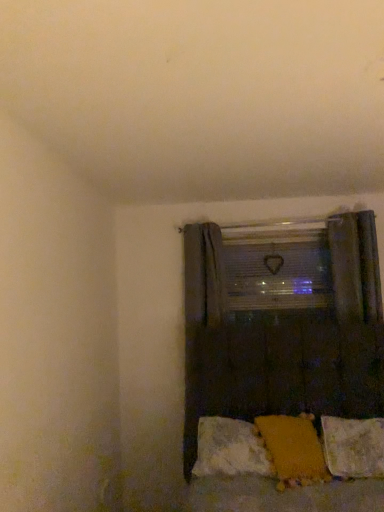
Describe the element at coordinates (230, 449) in the screenshot. The width and height of the screenshot is (384, 512). I see `orange fabric pillow at lower center, which is counted as the first pillow, starting from the left` at that location.

This screenshot has width=384, height=512. I want to click on fluffy white pillow at lower right, which is the first pillow in right-to-left order, so click(x=353, y=447).

Measure the distance between fluffy white pillow at lower right, which is the first pillow in right-to-left order, and camera.

A distance of 2.24 meters exists between fluffy white pillow at lower right, which is the first pillow in right-to-left order, and camera.

Identify the location of orange fabric pillow at lower center, the third pillow from the right. (230, 449).

Is orange fabric pillow at lower center, the third pillow from the right, inside or outside of yellow fabric pillow at lower center, which ranks as the 2th pillow in left-to-right order?

orange fabric pillow at lower center, the third pillow from the right, exists entirely within yellow fabric pillow at lower center, which ranks as the 2th pillow in left-to-right order.

From the image's perspective, is orange fabric pillow at lower center, the third pillow from the right, under yellow fabric pillow at lower center, which ranks as the 2th pillow in left-to-right order?

Correct, orange fabric pillow at lower center, the third pillow from the right, appears lower than yellow fabric pillow at lower center, which ranks as the 2th pillow in left-to-right order, in the image.

From a real-world perspective, is orange fabric pillow at lower center, which is counted as the first pillow, starting from the left, over yellow fabric pillow at lower center, positioned as the second pillow in right-to-left order?

No.

Can you confirm if orange fabric pillow at lower center, the third pillow from the right, is thinner than yellow fabric pillow at lower center, positioned as the second pillow in right-to-left order?

Indeed, orange fabric pillow at lower center, the third pillow from the right, has a lesser width compared to yellow fabric pillow at lower center, positioned as the second pillow in right-to-left order.

Is fluffy white pillow at lower right, the 3th pillow when ordered from left to right, behind orange fabric pillow at lower center, the third pillow from the right?

That is False.

Can we say fluffy white pillow at lower right, the 3th pillow when ordered from left to right, lies outside orange fabric pillow at lower center, which is counted as the first pillow, starting from the left?

fluffy white pillow at lower right, the 3th pillow when ordered from left to right, is positioned outside orange fabric pillow at lower center, which is counted as the first pillow, starting from the left.

From a real-world perspective, which pillow is the 1st one above the fluffy white pillow at lower right, which is the first pillow in right-to-left order? Please provide its 2D coordinates.

[(230, 449)]

From a real-world perspective, which object stands above the other?

orange fabric pillow at lower center, which is counted as the first pillow, starting from the left.

Relative to yellow fabric pillow at lower center, positioned as the second pillow in right-to-left order, is fluffy white pillow at lower right, the 3th pillow when ordered from left to right, in front or behind?

fluffy white pillow at lower right, the 3th pillow when ordered from left to right, is positioned farther from the viewer than yellow fabric pillow at lower center, positioned as the second pillow in right-to-left order.

Which of these two, fluffy white pillow at lower right, the 3th pillow when ordered from left to right, or yellow fabric pillow at lower center, positioned as the second pillow in right-to-left order, is smaller?

Smaller between the two is yellow fabric pillow at lower center, positioned as the second pillow in right-to-left order.

Measure the distance from fluffy white pillow at lower right, the 3th pillow when ordered from left to right, to yellow fabric pillow at lower center, positioned as the second pillow in right-to-left order.

They are 7.87 inches apart.

Is fluffy white pillow at lower right, which is the first pillow in right-to-left order, inside or outside of yellow fabric pillow at lower center, positioned as the second pillow in right-to-left order?

fluffy white pillow at lower right, which is the first pillow in right-to-left order, is spatially situated outside yellow fabric pillow at lower center, positioned as the second pillow in right-to-left order.

Looking at this image, from the image's perspective, is yellow fabric pillow at lower center, positioned as the second pillow in right-to-left order, located above clear plastic window screen at center?

No.

From a real-world perspective, is yellow fabric pillow at lower center, positioned as the second pillow in right-to-left order, under clear plastic window screen at center?

Yes.

Can you confirm if yellow fabric pillow at lower center, positioned as the second pillow in right-to-left order, is positioned to the left of clear plastic window screen at center?

Yes, yellow fabric pillow at lower center, positioned as the second pillow in right-to-left order, is to the left of clear plastic window screen at center.

How different are the orientations of yellow fabric pillow at lower center, which ranks as the 2th pillow in left-to-right order, and clear plastic window screen at center in degrees?

16.5 degrees.

From a real-world perspective, which is physically below, clear plastic window screen at center or orange fabric pillow at lower center, the third pillow from the right?

orange fabric pillow at lower center, the third pillow from the right, from a real-world perspective.

In the scene shown: Which is more to the right, clear plastic window screen at center or orange fabric pillow at lower center, which is counted as the first pillow, starting from the left?

Positioned to the right is clear plastic window screen at center.

Is clear plastic window screen at center oriented towards orange fabric pillow at lower center, the third pillow from the right?

No, clear plastic window screen at center is not aimed at orange fabric pillow at lower center, the third pillow from the right.

From the image's perspective, is yellow fabric pillow at lower center, which ranks as the 2th pillow in left-to-right order, located above fluffy white pillow at lower right, which is the first pillow in right-to-left order?

Yes, from the image's perspective, yellow fabric pillow at lower center, which ranks as the 2th pillow in left-to-right order, is on top of fluffy white pillow at lower right, which is the first pillow in right-to-left order.

The width and height of the screenshot is (384, 512). Find the location of `the 2nd pillow above the fluffy white pillow at lower right, the 3th pillow when ordered from left to right (from the image's perspective)`. the 2nd pillow above the fluffy white pillow at lower right, the 3th pillow when ordered from left to right (from the image's perspective) is located at coordinates (293, 449).

Is yellow fabric pillow at lower center, positioned as the second pillow in right-to-left order, taller or shorter than fluffy white pillow at lower right, the 3th pillow when ordered from left to right?

Considering their sizes, yellow fabric pillow at lower center, positioned as the second pillow in right-to-left order, has more height than fluffy white pillow at lower right, the 3th pillow when ordered from left to right.

From a real-world perspective, is yellow fabric pillow at lower center, which ranks as the 2th pillow in left-to-right order, on fluffy white pillow at lower right, which is the first pillow in right-to-left order?

Indeed, from a real-world perspective, yellow fabric pillow at lower center, which ranks as the 2th pillow in left-to-right order, stands above fluffy white pillow at lower right, which is the first pillow in right-to-left order.

Is the position of clear plastic window screen at center more distant than that of yellow fabric pillow at lower center, which ranks as the 2th pillow in left-to-right order?

Yes, the depth of clear plastic window screen at center is greater than that of yellow fabric pillow at lower center, which ranks as the 2th pillow in left-to-right order.

Is clear plastic window screen at center not close to yellow fabric pillow at lower center, which ranks as the 2th pillow in left-to-right order?

Yes.

Considering the sizes of objects clear plastic window screen at center and yellow fabric pillow at lower center, positioned as the second pillow in right-to-left order, in the image provided, who is shorter, clear plastic window screen at center or yellow fabric pillow at lower center, positioned as the second pillow in right-to-left order,?

yellow fabric pillow at lower center, positioned as the second pillow in right-to-left order, is shorter.

Can you tell me how much clear plastic window screen at center and yellow fabric pillow at lower center, positioned as the second pillow in right-to-left order, differ in facing direction?

The angle between the facing direction of clear plastic window screen at center and the facing direction of yellow fabric pillow at lower center, positioned as the second pillow in right-to-left order, is 16.5 degrees.

Identify the location of pillow to the left of yellow fabric pillow at lower center, positioned as the second pillow in right-to-left order. The height and width of the screenshot is (512, 384). (230, 449).

The width and height of the screenshot is (384, 512). I want to click on pillow beneath the orange fabric pillow at lower center, which is counted as the first pillow, starting from the left (from a real-world perspective), so click(x=353, y=447).

From the image, which object appears to be nearer to fluffy white pillow at lower right, which is the first pillow in right-to-left order, clear plastic window screen at center or orange fabric pillow at lower center, which is counted as the first pillow, starting from the left?

The object closer to fluffy white pillow at lower right, which is the first pillow in right-to-left order, is orange fabric pillow at lower center, which is counted as the first pillow, starting from the left.

Considering their positions, is fluffy white pillow at lower right, which is the first pillow in right-to-left order, positioned closer to yellow fabric pillow at lower center, which ranks as the 2th pillow in left-to-right order, than clear plastic window screen at center?

Based on the image, fluffy white pillow at lower right, which is the first pillow in right-to-left order, appears to be nearer to yellow fabric pillow at lower center, which ranks as the 2th pillow in left-to-right order.

From the image, which object appears to be farther from orange fabric pillow at lower center, which is counted as the first pillow, starting from the left, fluffy white pillow at lower right, the 3th pillow when ordered from left to right, or yellow fabric pillow at lower center, which ranks as the 2th pillow in left-to-right order?

fluffy white pillow at lower right, the 3th pillow when ordered from left to right, lies further to orange fabric pillow at lower center, which is counted as the first pillow, starting from the left, than the other object.

When comparing their distances from yellow fabric pillow at lower center, which ranks as the 2th pillow in left-to-right order, does orange fabric pillow at lower center, the third pillow from the right, or fluffy white pillow at lower right, which is the first pillow in right-to-left order, seem closer?

orange fabric pillow at lower center, the third pillow from the right, lies closer to yellow fabric pillow at lower center, which ranks as the 2th pillow in left-to-right order, than the other object.

Which object lies further to the anchor point clear plastic window screen at center, yellow fabric pillow at lower center, positioned as the second pillow in right-to-left order, or orange fabric pillow at lower center, the third pillow from the right?

Among the two, yellow fabric pillow at lower center, positioned as the second pillow in right-to-left order, is located further to clear plastic window screen at center.

Based on their spatial positions, is yellow fabric pillow at lower center, positioned as the second pillow in right-to-left order, or orange fabric pillow at lower center, the third pillow from the right, further from fluffy white pillow at lower right, the 3th pillow when ordered from left to right?

Among the two, orange fabric pillow at lower center, the third pillow from the right, is located further to fluffy white pillow at lower right, the 3th pillow when ordered from left to right.

Estimate the real-world distances between objects in this image. Which object is further from fluffy white pillow at lower right, which is the first pillow in right-to-left order, clear plastic window screen at center or yellow fabric pillow at lower center, positioned as the second pillow in right-to-left order?

Among the two, clear plastic window screen at center is located further to fluffy white pillow at lower right, which is the first pillow in right-to-left order.

From the image, which object appears to be nearer to orange fabric pillow at lower center, which is counted as the first pillow, starting from the left, yellow fabric pillow at lower center, positioned as the second pillow in right-to-left order, or fluffy white pillow at lower right, which is the first pillow in right-to-left order?

Based on the image, yellow fabric pillow at lower center, positioned as the second pillow in right-to-left order, appears to be nearer to orange fabric pillow at lower center, which is counted as the first pillow, starting from the left.

Where is `pillow between fluffy white pillow at lower right, which is the first pillow in right-to-left order, and clear plastic window screen at center from front to back`? The image size is (384, 512). pillow between fluffy white pillow at lower right, which is the first pillow in right-to-left order, and clear plastic window screen at center from front to back is located at coordinates (230, 449).

Where is `pillow between orange fabric pillow at lower center, which is counted as the first pillow, starting from the left, and fluffy white pillow at lower right, the 3th pillow when ordered from left to right, in the horizontal direction`? The height and width of the screenshot is (512, 384). pillow between orange fabric pillow at lower center, which is counted as the first pillow, starting from the left, and fluffy white pillow at lower right, the 3th pillow when ordered from left to right, in the horizontal direction is located at coordinates (293, 449).